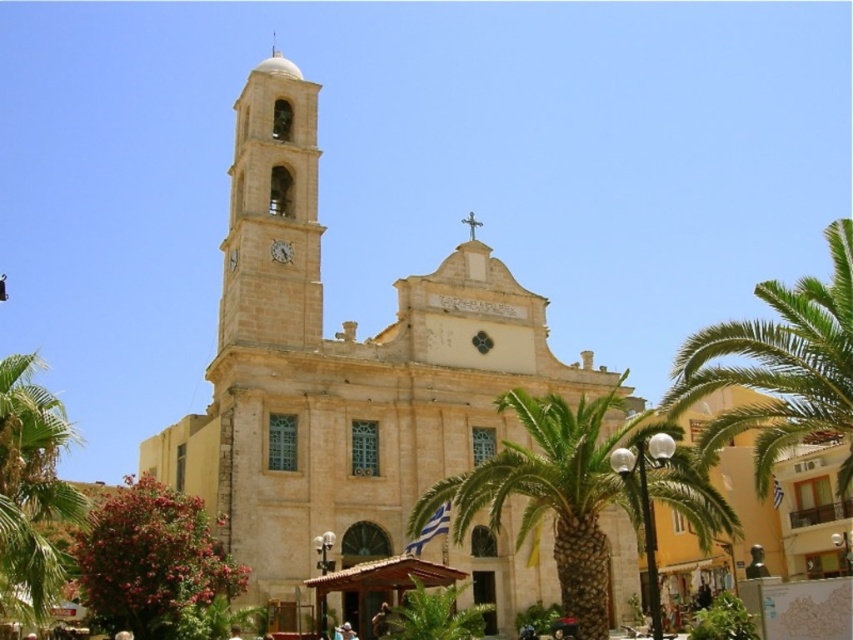
Does green leafy palm tree at right have a lesser width compared to green leafy palm tree at left?

No, green leafy palm tree at right is not thinner than green leafy palm tree at left.

Does green leafy palm tree at right appear on the right side of green leafy palm tree at left?

Indeed, green leafy palm tree at right is positioned on the right side of green leafy palm tree at left.

Who is more forward, (813, 298) or (57, 584)?

Positioned in front is point (57, 584).

Locate an element on the screen. The image size is (853, 640). green leafy palm tree at right is located at coordinates (780, 365).

Is green leafy palm tree at center bigger than light beige stone bell tower at upper left?

Yes.

Does green leafy palm tree at center appear over light beige stone bell tower at upper left?

No, green leafy palm tree at center is not above light beige stone bell tower at upper left.

Is point (672, 464) positioned in front of point (244, 211)?

Yes, point (672, 464) is in front of point (244, 211).

You are a GUI agent. You are given a task and a screenshot of the screen. Output one action in this format:
    pyautogui.click(x=<x>, y=<y>)
    Task: Click on the green leafy palm tree at center
    Image resolution: width=853 pixels, height=640 pixels.
    Given the screenshot: What is the action you would take?
    pyautogui.click(x=556, y=490)

Which is above, light beige stone bell tower at upper left or green leafy palm tree at left?

light beige stone bell tower at upper left

Does point (294, 108) lie in front of point (76, 516)?

No, (294, 108) is behind (76, 516).

Is point (279, 157) positioned behind point (45, 602)?

Yes.

Where is `light beige stone bell tower at upper left`? light beige stone bell tower at upper left is located at coordinates (273, 212).